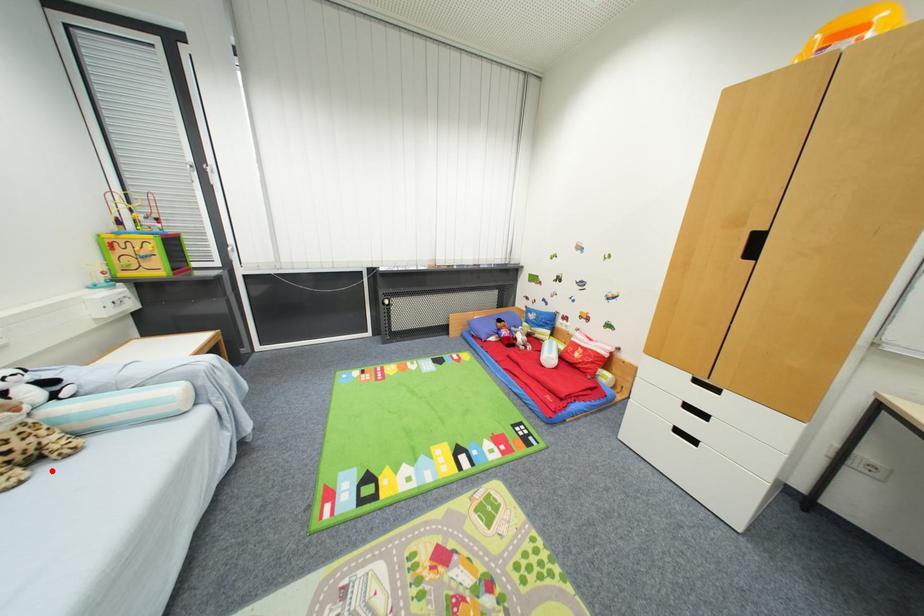
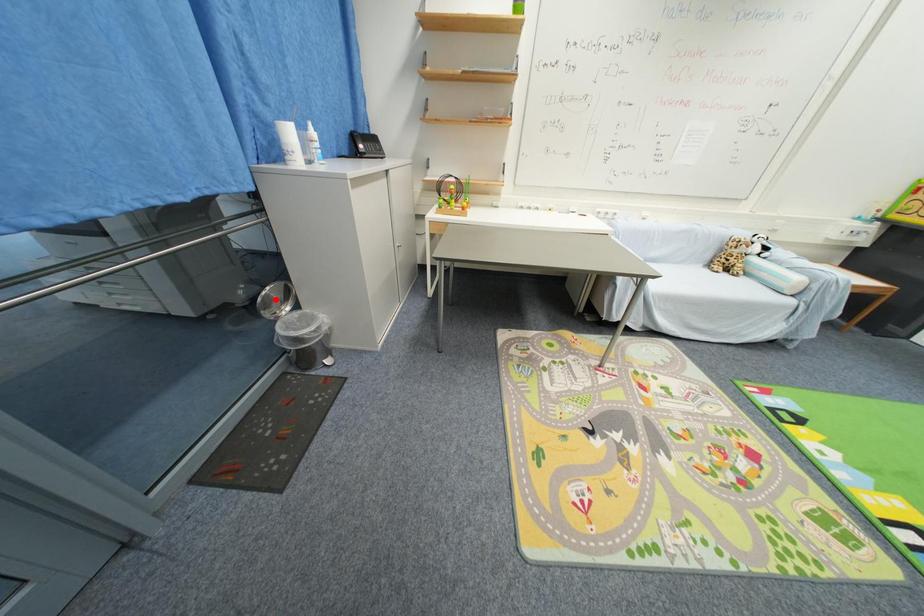
I am providing you with two images of the same scene from different viewpoints. A red point is marked on the first image and another point is marked on the second image. Is the marked point in image1 the same physical position as the marked point in image2?

No